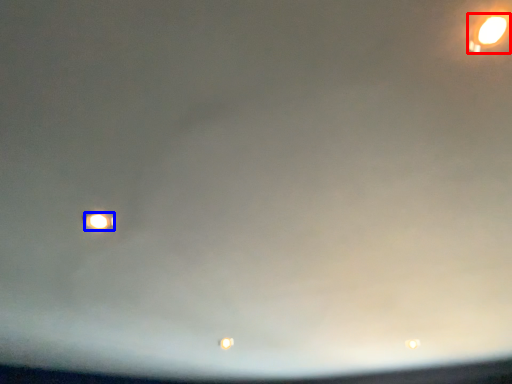
Question: Which object is closer to the camera taking this photo, street light (highlighted by a red box) or street light (highlighted by a blue box)?

Choices:
 (A) street light
 (B) street light

Answer: (A)